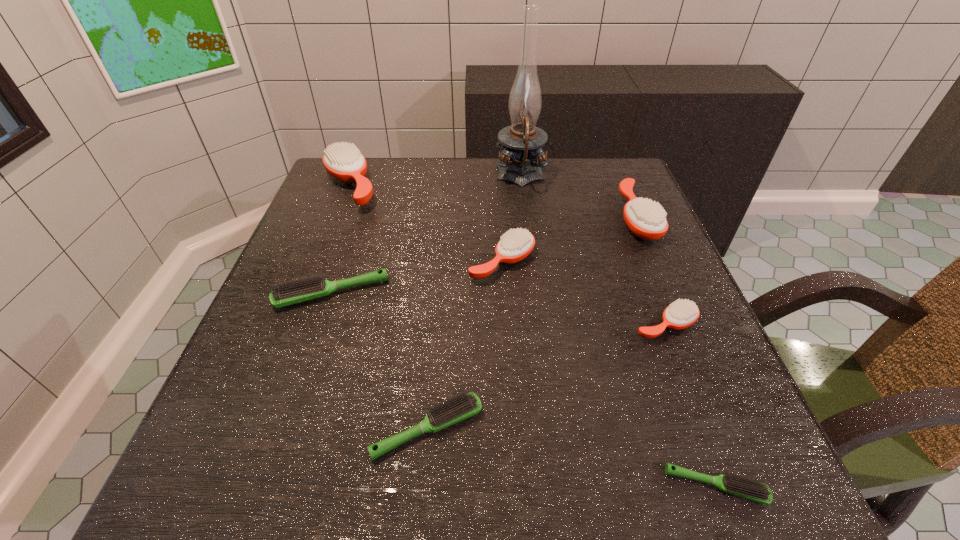
Identify the location of vacant space at the far right corner. (579, 191).

The height and width of the screenshot is (540, 960). I want to click on free spot at the near right corner of the desktop, so click(690, 502).

At what (x,y) coordinates should I click in order to perform the action: click on blank region between the tallest object and the biggest orange hairbrush. Please return your answer as a coordinate pair (x, y). The height and width of the screenshot is (540, 960). Looking at the image, I should click on (435, 181).

I want to click on blank region between the nearest light hairbrush and the nearest orange hairbrush, so click(690, 406).

What are the coordinates of `empty location between the fourth tallest object and the nearest object` in the screenshot? It's located at (609, 374).

This screenshot has height=540, width=960. In order to click on free space between the sixth shortest hairbrush and the tallest object in this screenshot , I will do `click(579, 197)`.

This screenshot has height=540, width=960. In order to click on vacant area that lies between the tallest object and the biggest light hairbrush in this screenshot , I will do 426,235.

I want to click on free space between the smallest light hairbrush and the second biggest light hairbrush, so click(x=571, y=457).

Identify the location of free area in between the second biggest orange hairbrush and the second light hairbrush from left to right. (532, 323).

Where is `free spot between the second shortest hairbrush and the nearest hairbrush`? The image size is (960, 540). free spot between the second shortest hairbrush and the nearest hairbrush is located at coordinates (571, 457).